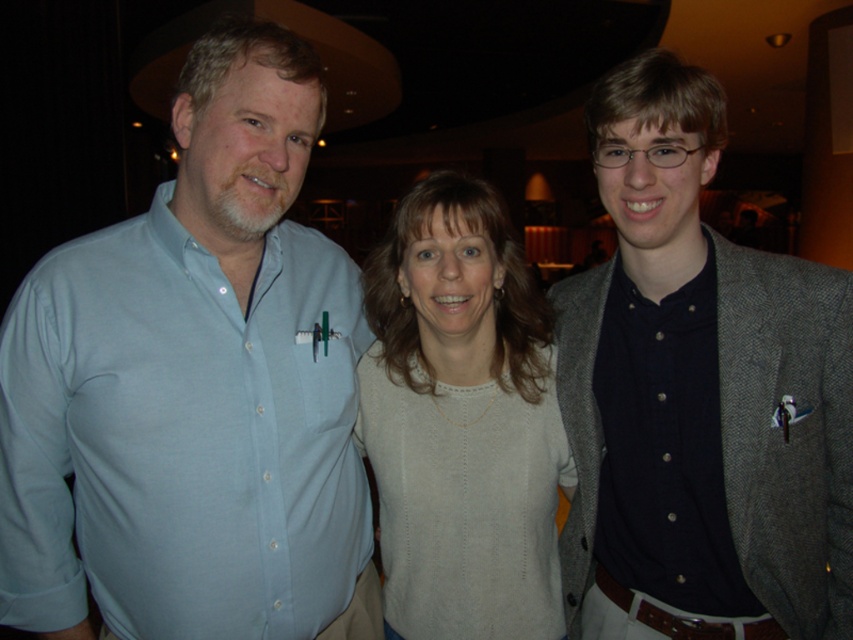
Based on the scene description, where is the light blue shirt located relative to the point at coordinates (194, 388)?

The light blue shirt at left is located at the point (194, 388).